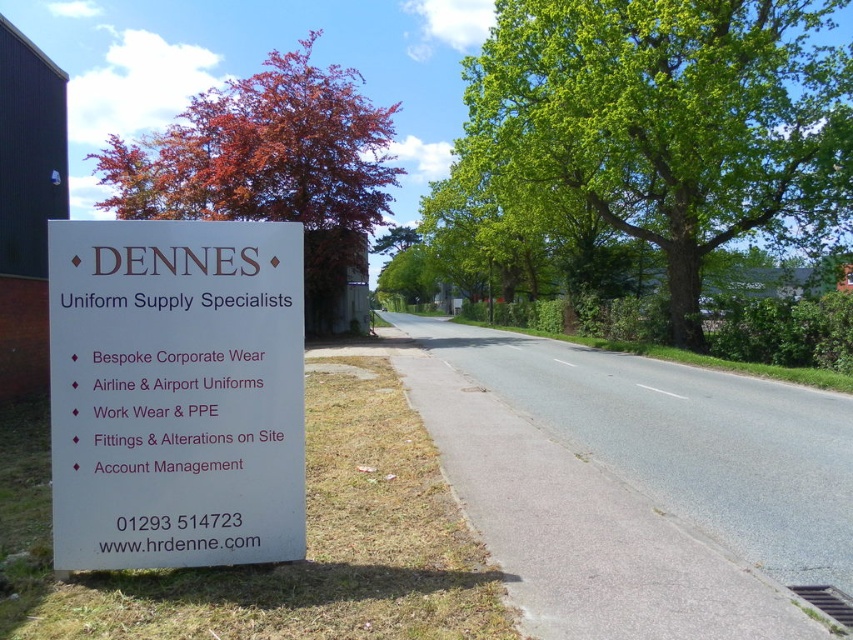
You are a pedestrian standing on the sidewalk and looking at the white plastic sign at left. Is there a green leafy tree at upper right blocking your view of the sign?

The green leafy tree at upper right is located above the white plastic sign at left, so it might block the view of the sign depending on the tree branches and leaves.